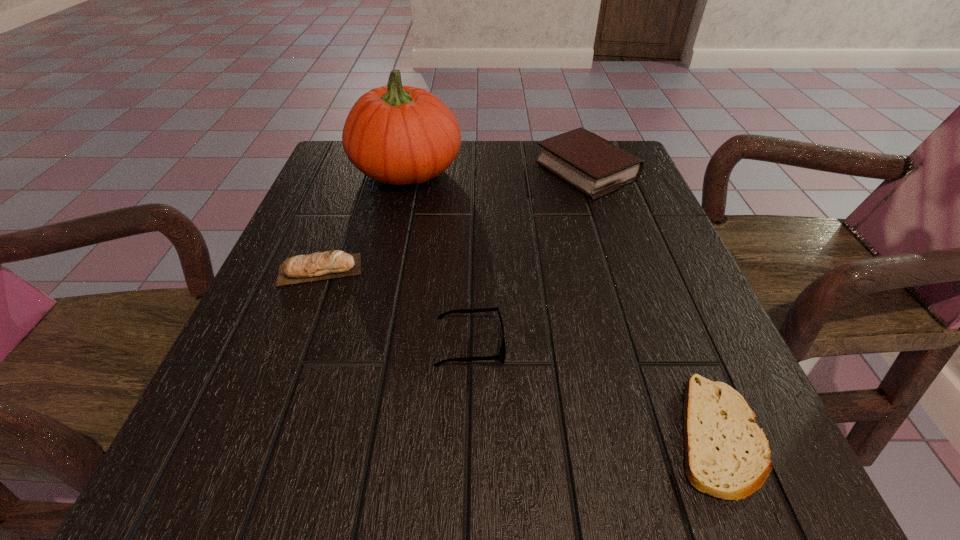
In order to click on pumpkin in this screenshot , I will do `click(400, 135)`.

At what (x,y) coordinates should I click in order to perform the action: click on Bible. Please return your answer as a coordinate pair (x, y). The height and width of the screenshot is (540, 960). Looking at the image, I should click on (596, 167).

Identify the location of the second nearest object. This screenshot has width=960, height=540. click(x=502, y=353).

The image size is (960, 540). Find the location of `the third farthest object`. the third farthest object is located at coordinates (324, 265).

The image size is (960, 540). In order to click on the farther pita bread in this screenshot , I will do `click(324, 265)`.

Identify the location of the nearest object. (727, 455).

At what (x,y) coordinates should I click in order to perform the action: click on the nearer pita bread. Please return your answer as a coordinate pair (x, y). The height and width of the screenshot is (540, 960). Looking at the image, I should click on (727, 455).

The height and width of the screenshot is (540, 960). In order to click on vacant area situated on the front of the pumpkin in this screenshot , I will do `click(394, 226)`.

Locate an element on the screen. This screenshot has width=960, height=540. free point located 0.220m on the left of the second tallest object is located at coordinates (448, 171).

Where is `vacant space situated 0.100m on the front-facing side of the sunglasses`? The width and height of the screenshot is (960, 540). vacant space situated 0.100m on the front-facing side of the sunglasses is located at coordinates (566, 345).